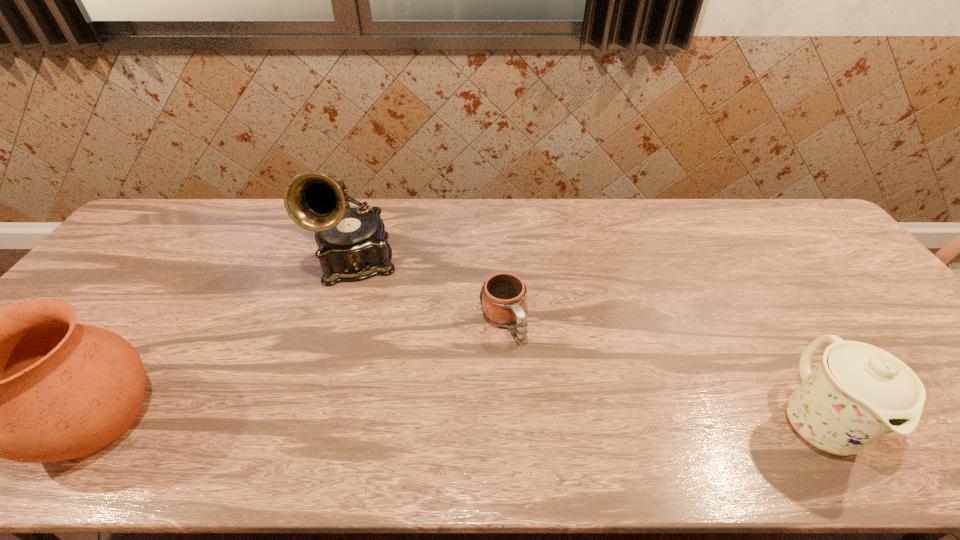
Identify the location of free area in between the mug and the phonograph record. (429, 292).

Where is `vacant area that lies between the chinaware and the tallest object`? vacant area that lies between the chinaware and the tallest object is located at coordinates (586, 341).

This screenshot has width=960, height=540. In order to click on free space between the third tallest object and the second farthest object in this screenshot , I will do (660, 372).

At what (x,y) coordinates should I click in order to perform the action: click on object that ranks as the closest to the leftmost object. Please return your answer as a coordinate pair (x, y). The width and height of the screenshot is (960, 540). Looking at the image, I should click on (352, 245).

Identify the location of the closest object to the rightmost object. The image size is (960, 540). 503,296.